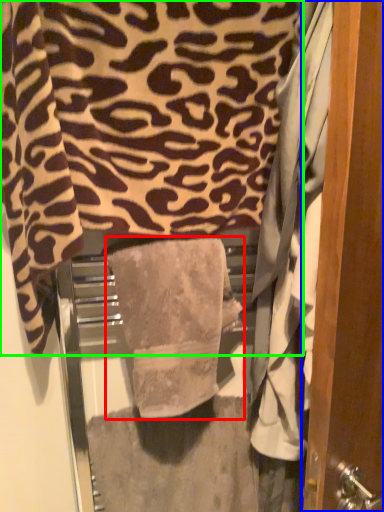
Question: Which object is the farthest from towel (highlighted by a red box)? Choose among these: door (highlighted by a blue box) or towel (highlighted by a green box).

Choices:
 (A) door
 (B) towel

Answer: (A)